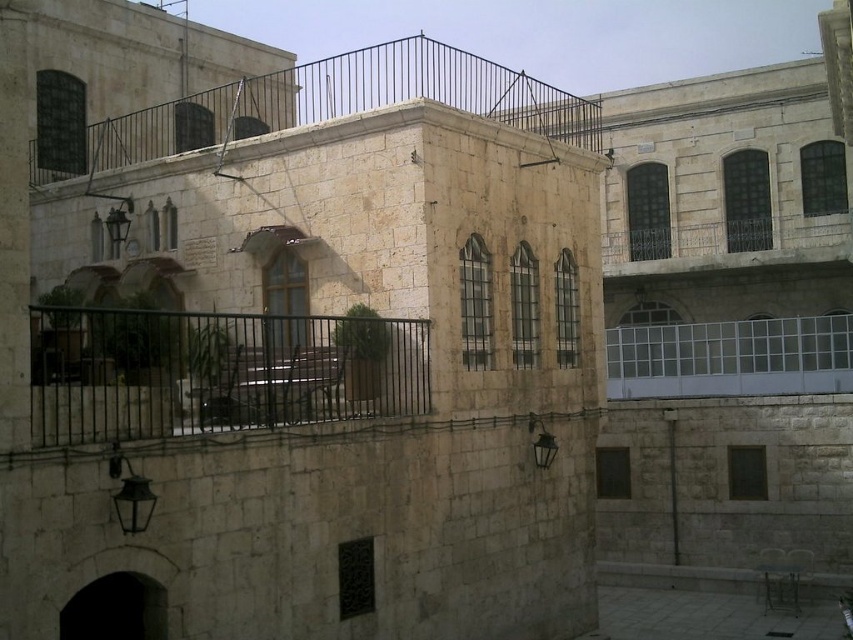
From the picture: You are standing in front of the traditional stone building and want to locate two specific points marked on the building. The first point is at coordinates point [228,397] and the second is at point [817,317]. From your current position, which point appears closer to you?

Point [228,397] is in front of point [817,317], so it appears closer to you.

You are a visitor at this historical site and want to sit down while enjoying the view from the balcony. The black metal bench at center and the clear glass balcony at center are both available. Which one has a wider seating area?

The clear glass balcony at center has a wider seating area since the black metal bench at center is thinner than it.

You are standing at the entrance of the traditional stone building and want to find the rustic stone balcony at upper center. According to the coordinates provided, where should you look relative to the building?

The rustic stone balcony at upper center is located at point coordinates 0.167 on the x axis and 0.380 on the y axis, so you should look towards the upper center area of the building to find it.